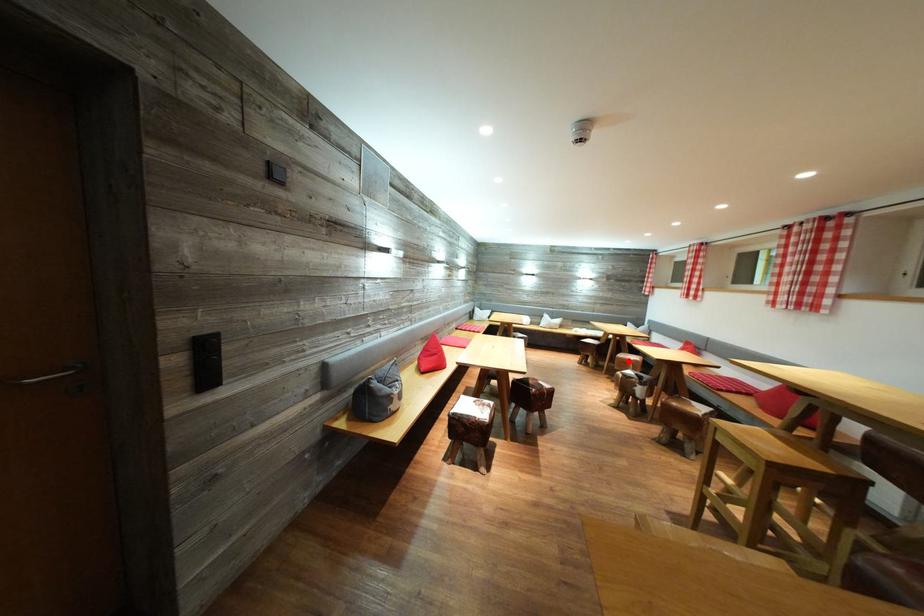
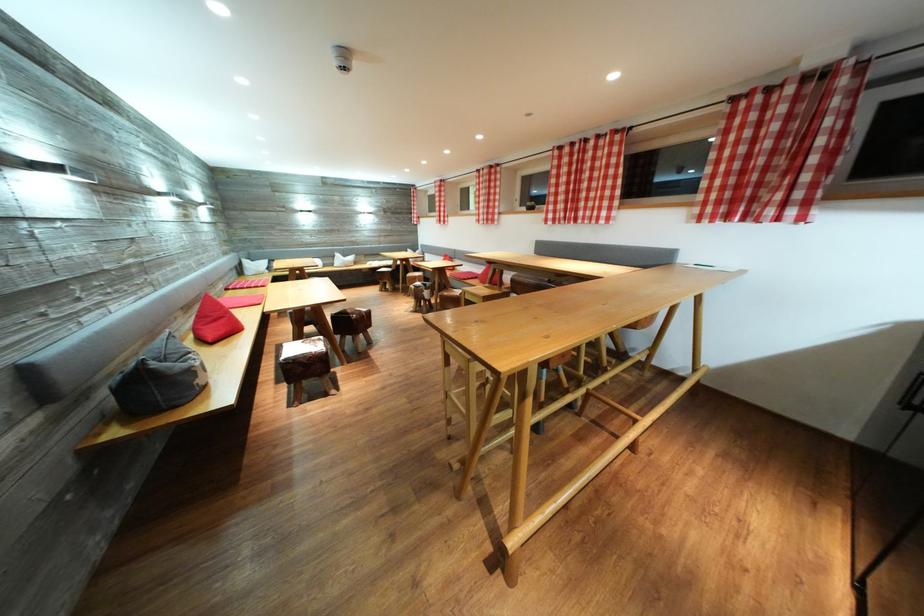
Question: I am providing you with two images of the same scene from different viewpoints. A red point is shown in image1. For the corresponding object point in image2, is it positioned nearer or farther from the camera?

Choices:
 (A) Nearer
 (B) Farther

Answer: (B)